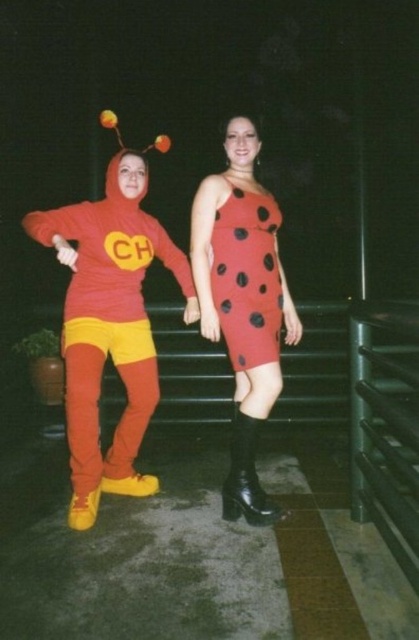
You are a photographer setting up a photo shoot for two models wearing the matte red dress with black polka dots at center and the red dotted dress at center. You need to position them so that the larger dress is visible to the audience. Which dress should be placed closer to the front?

The matte red dress with black polka dots at center is larger in size than the red dotted dress at center, so to ensure visibility, the larger matte red dress with black polka dots at center should be placed closer to the front.

You are a photographer trying to adjust the lighting for a photo shoot. You notice the matte red costume at left and the black leather boot at lower center. Which object should you focus on first if you want to ensure the closest subject gets proper lighting?

The matte red costume at left should be focused on first because it is in front of the black leather boot at lower center, making it closer to the camera.

You are a photographer trying to capture the perfect shot of the two costumed individuals. You want to focus on the center of the image. Which object from the scene is located at the exact center point marked by the coordinates point (x=243, y=301)?

The point (x=243, y=301) marks the matte red dress with black polka dots at center.